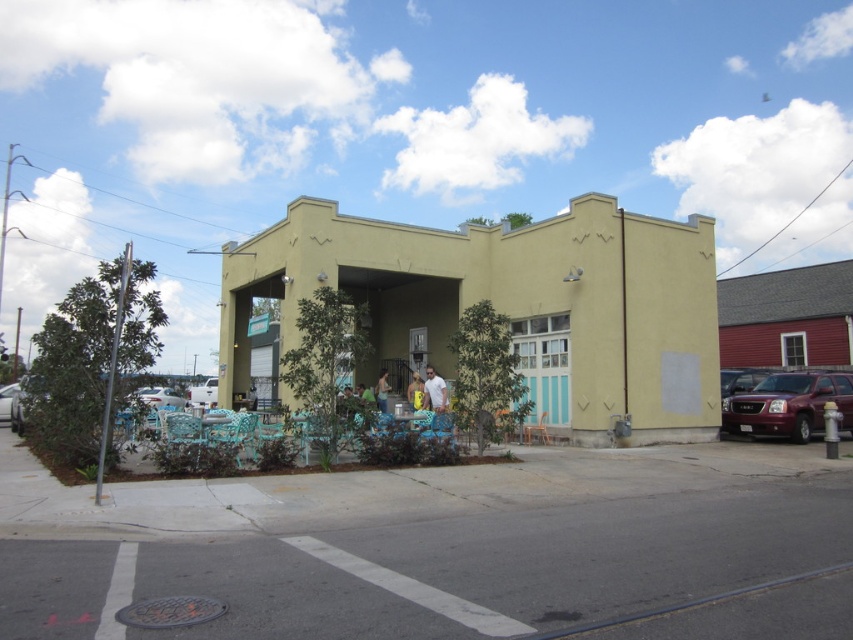
Is yellow stucco building at center to the right of white glossy car at lower left from the viewer's perspective?

Yes, yellow stucco building at center is to the right of white glossy car at lower left.

Between point (569, 397) and point (161, 404), which one is positioned in front?

Point (569, 397) is more forward.

Is point (239, 348) closer to viewer compared to point (152, 404)?

Yes, it is.

The width and height of the screenshot is (853, 640). Identify the location of yellow stucco building at center. (500, 308).

Who is higher up, white matte truck at left or silver metallic car at left?

Positioned higher is silver metallic car at left.

Can you confirm if white matte truck at left is shorter than silver metallic car at left?

No, white matte truck at left is not shorter than silver metallic car at left.

Find the location of a particular element. white matte truck at left is located at coordinates (202, 394).

Locate an element on the screen. The image size is (853, 640). white matte truck at left is located at coordinates (202, 394).

Between yellow stucco building at center and white matte truck at left, which one is positioned lower?

white matte truck at left is lower down.

Identify the location of yellow stucco building at center. The width and height of the screenshot is (853, 640). (500, 308).